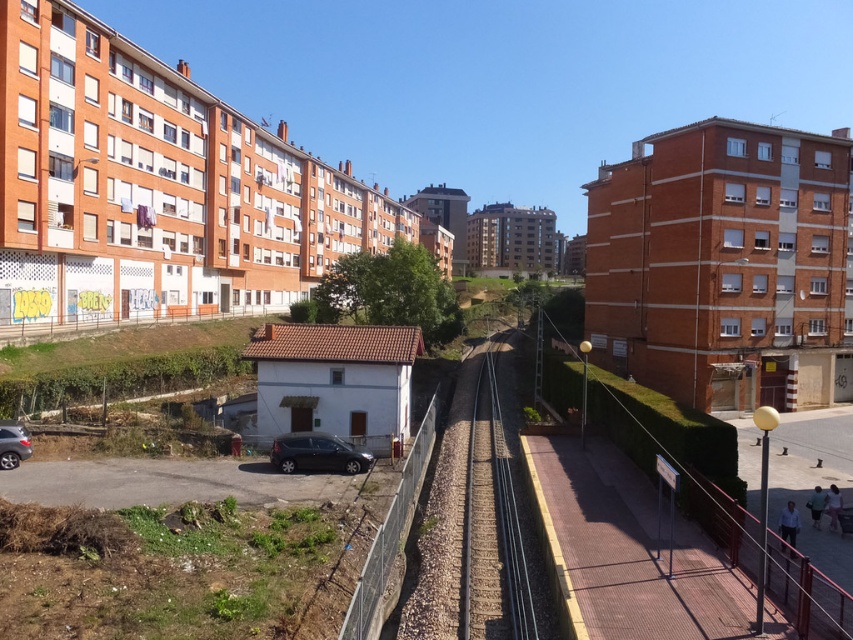
You are standing at the center of the image and want to walk towards the brown gravel train track at center. In which direction should you move?

Since the brown gravel train track at center is already at the center of the image, you are already facing it. No need to move in any direction.

You are a delivery driver who needs to cross the brown gravel train track at center with your matte black car at lower left. Can your car fit entirely on the track without crossing over the edges?

The brown gravel train track at center is wider than the matte black car at lower left, so the car can fit entirely on the track without crossing over the edges.

You are a delivery person trying to park your vehicle between the satin black car at lower center and the matte black car at lower left. Given that your delivery van is 5 meters long, can you fit it between them?

The satin black car at lower center is shorter than the matte black car at lower left, but the distance between them isn not specified. Without knowing the space between the two cars, it is impossible to determine if the van will fit.